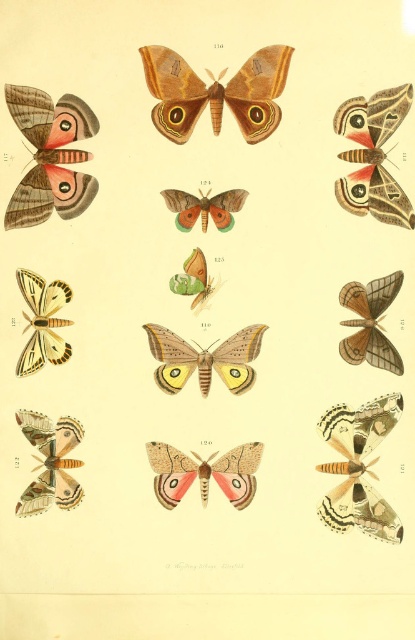
Is point (60, 449) positioned in front of point (36, 368)?

Yes.

Between point (43, 506) and point (65, 352), which one is positioned in front?

Point (43, 506)

Is point (80, 465) positioned behind point (53, 300)?

No, it is in front of (53, 300).

Where is `matte brown butterfly at lower left`? matte brown butterfly at lower left is located at coordinates (51, 461).

Can you confirm if matte brown butterfly at upper left is positioned to the right of matte brown butterfly at upper right?

In fact, matte brown butterfly at upper left is to the left of matte brown butterfly at upper right.

Is matte brown butterfly at upper left bigger than matte brown butterfly at upper right?

Indeed, matte brown butterfly at upper left has a larger size compared to matte brown butterfly at upper right.

Between point (29, 221) and point (392, 99), which one is positioned behind?

Positioned behind is point (29, 221).

Where is `matte brown butterfly at upper left`? This screenshot has width=415, height=640. matte brown butterfly at upper left is located at coordinates (49, 156).

Does matte yellow butterfly at center appear over translucent beige moth at center?

Yes, matte yellow butterfly at center is above translucent beige moth at center.

Is matte yellow butterfly at center below translucent beige moth at center?

Incorrect, matte yellow butterfly at center is not positioned below translucent beige moth at center.

Between point (175, 346) and point (161, 444), which one is positioned behind?

Positioned behind is point (175, 346).

What are the coordinates of `matte yellow butterfly at center` in the screenshot? It's located at (205, 358).